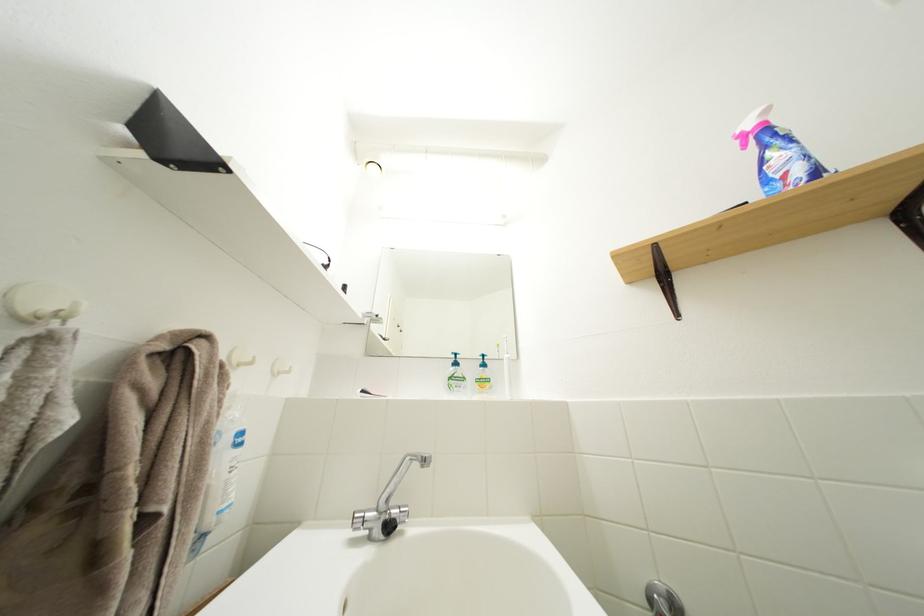
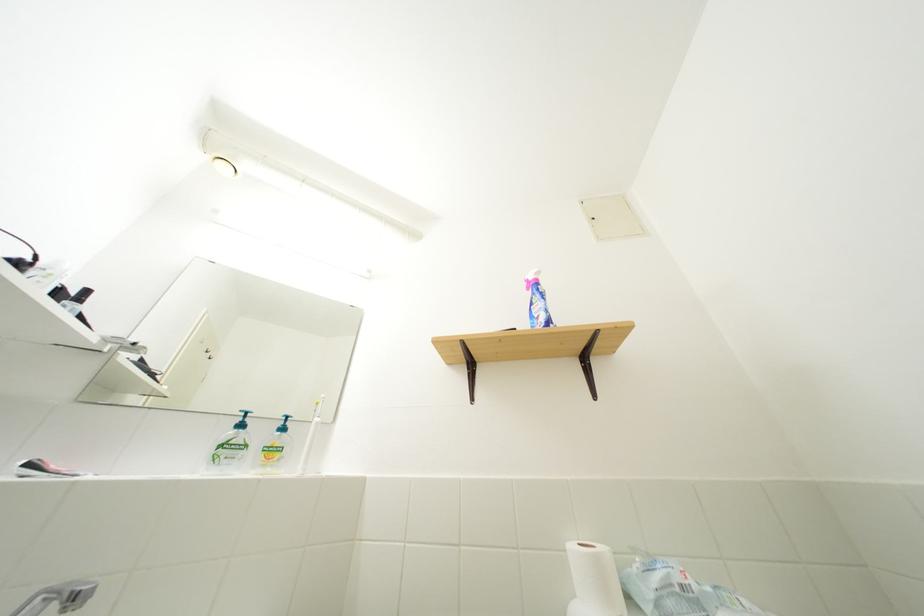
The point at [511,399] is marked in the first image. Where is the corresponding point in the second image?

(298, 474)